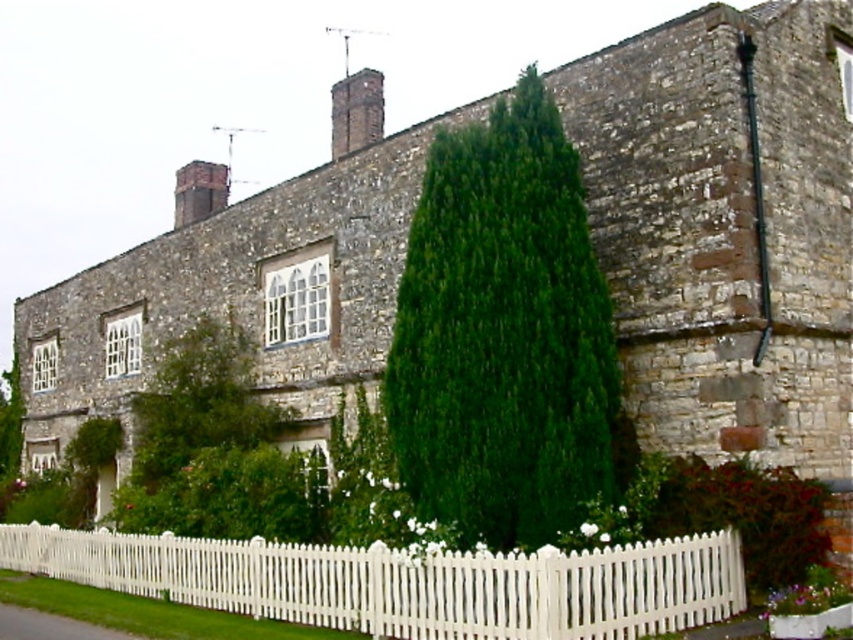
You are standing at the entrance of the traditional stone house and want to walk towards the point marked as point (3, 536). However, there is an obstacle at point (193, 173). Will you encounter this obstacle before reaching your destination?

Point (3, 536) is in front of point (193, 173), so you will reach the destination before encountering the obstacle.

You are standing at the entrance of the traditional stone house and want to place a new flower bed exactly at the center of the garden. The garden is represented by coordinates from 0 to 1 in both x and y directions. The green leafy tree at center is already present. Can you confirm if the flower bed will be placed directly under the tree?

The green leafy tree at center is located at coordinates point (503, 333), so placing the flower bed at the exact center of the garden would be at point (426, 320). Since the tree is slightly to the right and above the true center, the flower bed will not be directly under the tree.

You are standing in front of the traditional stone house and want to take a photo that includes both the point at coordinates point (682,557) and point (352,120). Based on their positions, which point is closer to you?

Point (682,557) is closer to the camera than point (352,120), so it will appear nearer in your photo.